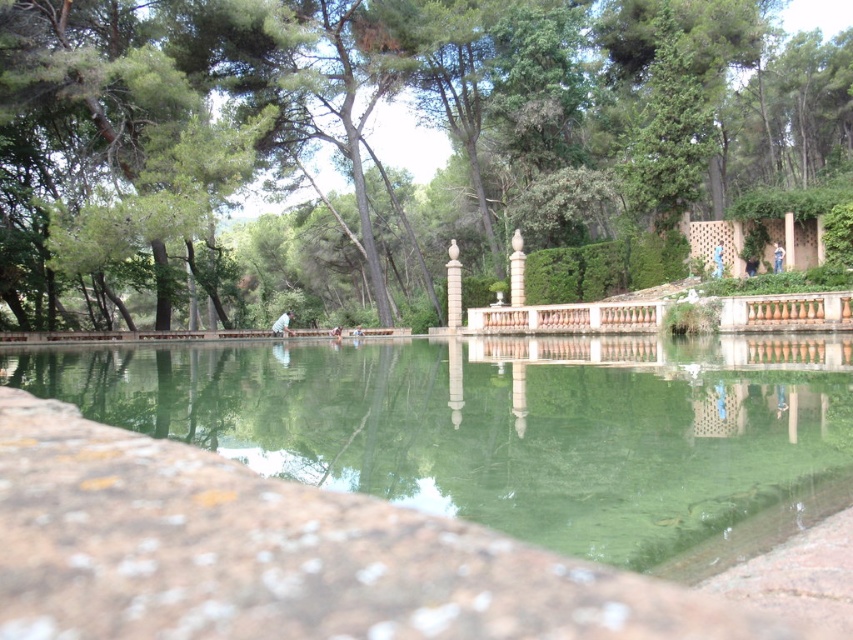
You are standing at the point closest to the viewer in the scene. Which of the two points, point (334, 147) or point (131, 380), is farther away from your current position?

Point (334, 147) is farther away from your current position because it is behind point (131, 380), which is closer to the viewer.

You are standing at the edge of the green stone pool at center and want to look towards the green leafy tree at upper center. In which direction should you turn your head?

The green leafy tree at upper center is to the right of the green stone pool at center, so you should turn your head to the right to look towards it.